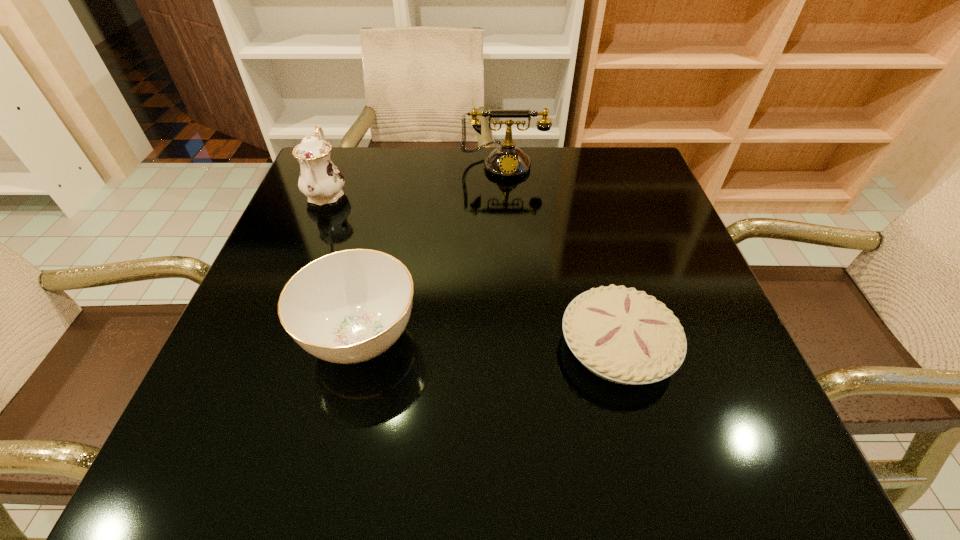
Find the location of a particular element. This screenshot has width=960, height=540. the second closest object to the left chinaware is located at coordinates (507, 161).